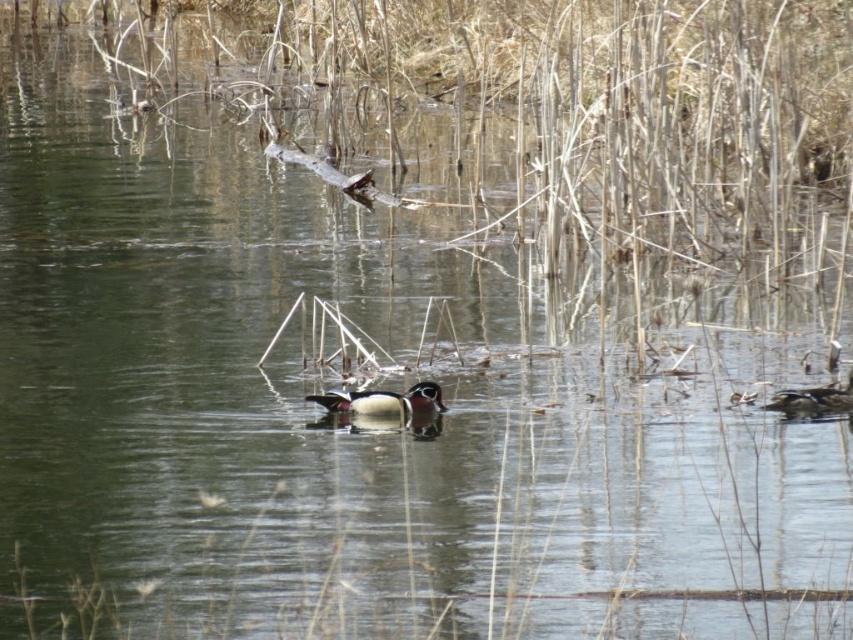
Question: Is wood grain duck at center positioned at the back of shiny brown duck at right?

Choices:
 (A) yes
 (B) no

Answer: (B)

Question: Is wood grain duck at center above shiny brown duck at right?

Choices:
 (A) yes
 (B) no

Answer: (A)

Question: Among these points, which one is nearest to the camera?

Choices:
 (A) (410, 410)
 (B) (848, 390)

Answer: (A)

Question: Can you confirm if wood grain duck at center is positioned to the right of shiny brown duck at right?

Choices:
 (A) yes
 (B) no

Answer: (B)